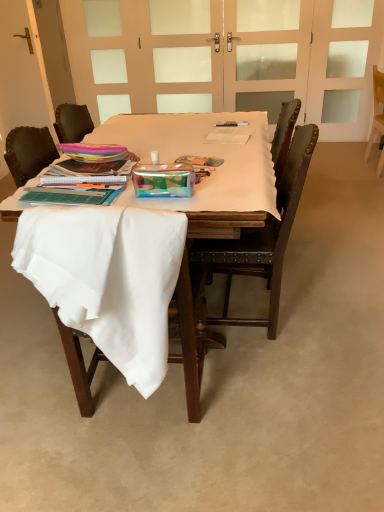
Question: Is wooden chair at right, arranged as the 1th chair when viewed from the back, far from white fabric-covered table at center?

Choices:
 (A) no
 (B) yes

Answer: (B)

Question: From the image's perspective, is wooden chair at right, placed as the 3th chair when sorted from front to back, under white fabric-covered table at center?

Choices:
 (A) yes
 (B) no

Answer: (B)

Question: Does wooden chair at right, placed as the 3th chair when sorted from front to back, have a greater height compared to white fabric-covered table at center?

Choices:
 (A) yes
 (B) no

Answer: (A)

Question: From a real-world perspective, is wooden chair at right, arranged as the 3th chair when viewed from the left, on white fabric-covered table at center?

Choices:
 (A) yes
 (B) no

Answer: (B)

Question: Is wooden chair at right, arranged as the 3th chair when viewed from the left, closer to camera compared to white fabric-covered table at center?

Choices:
 (A) yes
 (B) no

Answer: (B)

Question: Is wooden chair at right, placed as the 3th chair when sorted from front to back, not within white fabric-covered table at center?

Choices:
 (A) yes
 (B) no

Answer: (A)

Question: Can you confirm if white fabric chair at lower left, which ranks as the 3th chair in back-to-front order, is shorter than metallic silver pen at center?

Choices:
 (A) yes
 (B) no

Answer: (B)

Question: Is white fabric chair at lower left, which ranks as the 3th chair in back-to-front order, further to camera compared to metallic silver pen at center?

Choices:
 (A) no
 (B) yes

Answer: (A)

Question: From a real-world perspective, is white fabric chair at lower left, marked as the first chair in a left-to-right arrangement, positioned under metallic silver pen at center based on gravity?

Choices:
 (A) yes
 (B) no

Answer: (A)

Question: Is white fabric chair at lower left, marked as the first chair in a left-to-right arrangement, to the left of metallic silver pen at center from the viewer's perspective?

Choices:
 (A) no
 (B) yes

Answer: (B)

Question: Does white fabric chair at lower left, which is the third chair from right to left, have a lesser width compared to metallic silver pen at center?

Choices:
 (A) yes
 (B) no

Answer: (B)

Question: Does white fabric chair at lower left, which is counted as the first chair, starting from the front, contain metallic silver pen at center?

Choices:
 (A) no
 (B) yes

Answer: (A)

Question: Is white fabric chair at lower left, which is counted as the first chair, starting from the front, taller than transparent glass screen door at upper center, which ranks as the second screen door in right-to-left order?

Choices:
 (A) yes
 (B) no

Answer: (B)